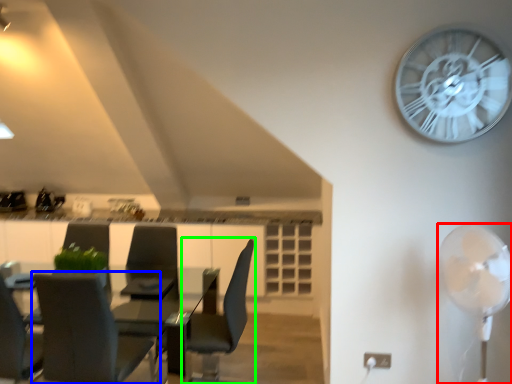
Question: Considering the real-world distances, which object is closest to mechanical fan (highlighted by a red box)? chair (highlighted by a blue box) or chair (highlighted by a green box).

Choices:
 (A) chair
 (B) chair

Answer: (B)